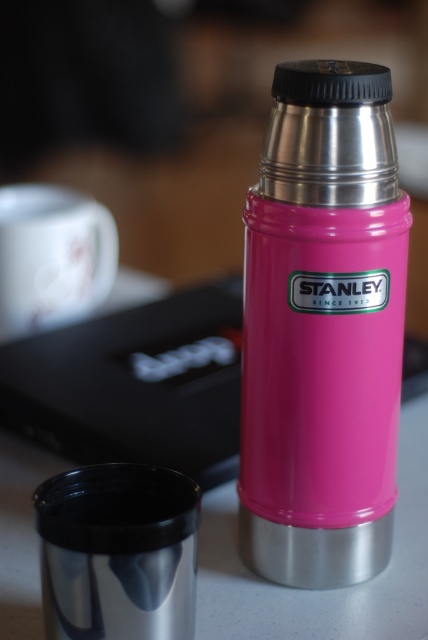
Question: Which object appears farthest from the camera in this image?

Choices:
 (A) shiny metallic mug at center
 (B) white glossy mug at upper left
 (C) pink matte stanley thermos at center

Answer: (B)

Question: Which of the following is the closest to the observer?

Choices:
 (A) (50, 592)
 (B) (70, 276)

Answer: (A)

Question: Which is nearer to the white glossy mug at upper left?

Choices:
 (A) pink matte stanley thermos at center
 (B) shiny metallic mug at center

Answer: (A)

Question: Observing the image, what is the correct spatial positioning of shiny metallic mug at center in reference to white glossy mug at upper left?

Choices:
 (A) above
 (B) below

Answer: (B)

Question: Is shiny metallic mug at center to the left of white glossy mug at upper left from the viewer's perspective?

Choices:
 (A) no
 (B) yes

Answer: (A)

Question: Is pink matte stanley thermos at center smaller than shiny metallic mug at center?

Choices:
 (A) yes
 (B) no

Answer: (B)